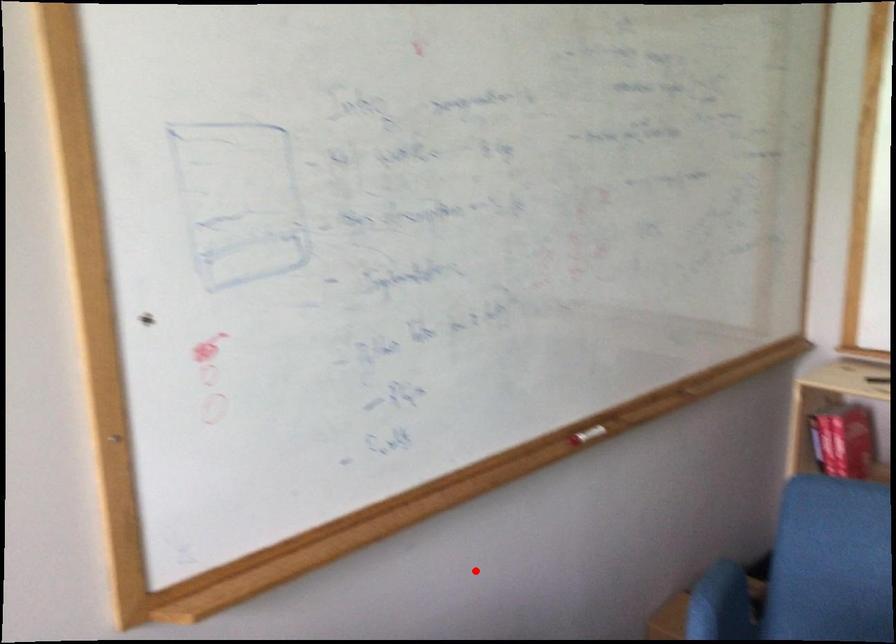
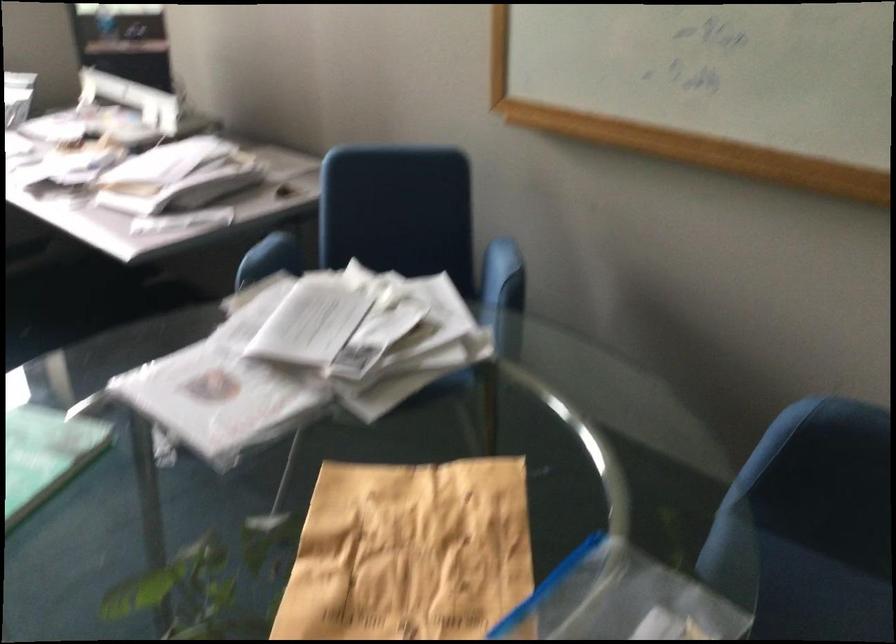
Question: I am providing you with two images of the same scene from different viewpoints. A red point is marked on the first image. Can you still see the location of the red point in image 2?

Choices:
 (A) Yes
 (B) No

Answer: (A)